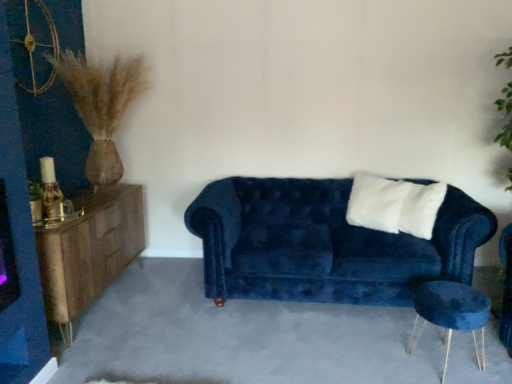
Question: Would you say woodenmaterial/texturedresser at left contains velvet blue side table at lower right?

Choices:
 (A) yes
 (B) no

Answer: (B)

Question: From a real-world perspective, is woodenmaterial/texturedresser at left below velvet blue side table at lower right?

Choices:
 (A) yes
 (B) no

Answer: (B)

Question: Is woodenmaterial/texturedresser at left at the left side of velvet blue side table at lower right?

Choices:
 (A) no
 (B) yes

Answer: (B)

Question: Considering the relative sizes of woodenmaterial/texturedresser at left and velvet blue side table at lower right in the image provided, is woodenmaterial/texturedresser at left shorter than velvet blue side table at lower right?

Choices:
 (A) yes
 (B) no

Answer: (B)

Question: From the image's perspective, would you say woodenmaterial/texturedresser at left is shown under velvet blue side table at lower right?

Choices:
 (A) yes
 (B) no

Answer: (B)

Question: Is woodenmaterial/texturedresser at left facing away from velvet blue side table at lower right?

Choices:
 (A) no
 (B) yes

Answer: (A)

Question: Is velvet blue couch at center surrounding velvet blue side table at lower right?

Choices:
 (A) yes
 (B) no

Answer: (B)

Question: From a real-world perspective, is velvet blue couch at center positioned under velvet blue side table at lower right based on gravity?

Choices:
 (A) no
 (B) yes

Answer: (A)

Question: Can you confirm if velvet blue couch at center is positioned to the right of velvet blue side table at lower right?

Choices:
 (A) yes
 (B) no

Answer: (B)

Question: From the image's perspective, is velvet blue couch at center over velvet blue side table at lower right?

Choices:
 (A) yes
 (B) no

Answer: (A)

Question: Considering the relative positions of velvet blue couch at center and velvet blue side table at lower right in the image provided, is velvet blue couch at center in front of velvet blue side table at lower right?

Choices:
 (A) yes
 (B) no

Answer: (B)

Question: Is velvet blue side table at lower right at the back of velvet blue couch at center?

Choices:
 (A) yes
 (B) no

Answer: (B)

Question: Is velvet blue couch at center positioned before woodenmaterial/texturedresser at left?

Choices:
 (A) no
 (B) yes

Answer: (A)